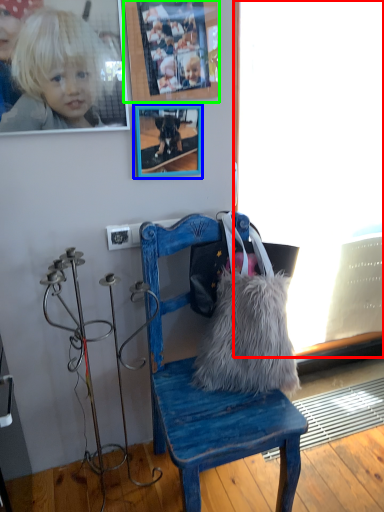
Question: Considering the real-world distances, which object is farthest from window screen (highlighted by a red box)? picture frame (highlighted by a blue box) or picture frame (highlighted by a green box)?

Choices:
 (A) picture frame
 (B) picture frame

Answer: (A)